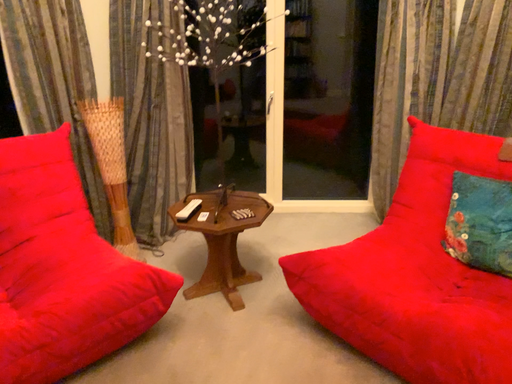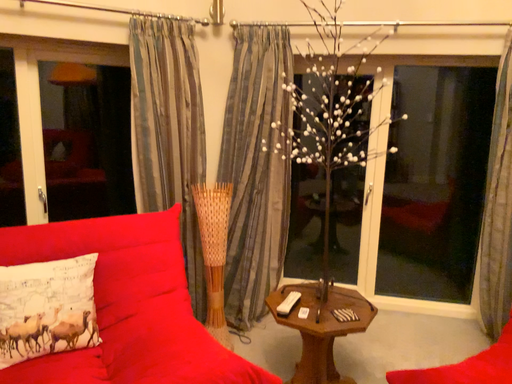
Question: How did the camera likely rotate when shooting the video?

Choices:
 (A) rotated downward
 (B) rotated upward

Answer: (B)